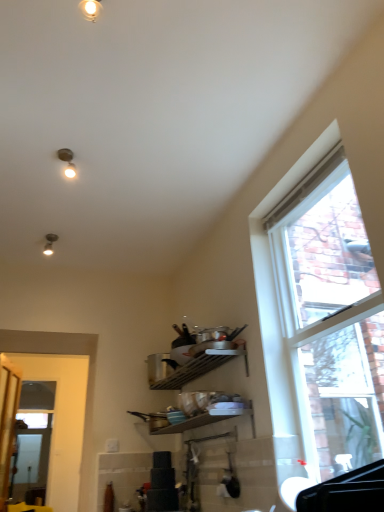
In order to face white glossy door at left, should I rotate leftwards or rightwards?

Rotate left and turn 19.771 degrees.

What is the approximate height of clear glass window at right?

clear glass window at right is 5.05 feet in height.

Describe the element at coordinates (49, 244) in the screenshot. The height and width of the screenshot is (512, 384). I see `matte silver light fixture at upper left, the 2th light fixture positioned from the right` at that location.

Identify the location of clear glass screen door at left. The image size is (384, 512). (30, 462).

Is clear glass window at right at the right side of clear glass screen door at left?

Correct, you'll find clear glass window at right to the right of clear glass screen door at left.

Considering the relative sizes of clear glass window at right and clear glass screen door at left in the image provided, is clear glass window at right taller than clear glass screen door at left?

Incorrect, the height of clear glass window at right is not larger of that of clear glass screen door at left.

Considering the relative sizes of clear glass window at right and clear glass screen door at left in the image provided, is clear glass window at right smaller than clear glass screen door at left?

No.

Is clear glass window at right oriented towards clear glass screen door at left?

No, clear glass window at right is not oriented towards clear glass screen door at left.

Looking at this image, is matte white light fixture at upper center, which appears as the first light fixture when viewed from the top, behind white glossy door at left?

No, the depth of matte white light fixture at upper center, which appears as the first light fixture when viewed from the top, is less than that of white glossy door at left.

From the image's perspective, is matte white light fixture at upper center, acting as the first light fixture starting from the front, located above white glossy door at left?

Indeed, from the image's perspective, matte white light fixture at upper center, acting as the first light fixture starting from the front, is shown above white glossy door at left.

From a real-world perspective, is matte white light fixture at upper center, acting as the first light fixture starting from the front, physically located above or below white glossy door at left?

In terms of real-world spatial position, matte white light fixture at upper center, acting as the first light fixture starting from the front, is above white glossy door at left.

Is clear glass screen door at left far from clear glass window at right?

Yes, clear glass screen door at left and clear glass window at right are located far from each other.

Consider the image. Considering the positions of objects clear glass screen door at left and clear glass window at right in the image provided, who is more to the left, clear glass screen door at left or clear glass window at right?

Positioned to the left is clear glass screen door at left.

Which is closer, (41, 470) or (274, 322)?

The point (274, 322) is more forward.

Does clear glass screen door at left have a lesser height compared to clear glass window at right?

Incorrect, the height of clear glass screen door at left does not fall short of that of clear glass window at right.

Is point (48, 234) less distant than point (23, 451)?

Yes.

Looking at this image, considering the sizes of matte silver light fixture at upper left, the first light fixture from the back, and clear glass screen door at left in the image, is matte silver light fixture at upper left, the first light fixture from the back, wider or thinner than clear glass screen door at left?

Clearly, matte silver light fixture at upper left, the first light fixture from the back, has more width compared to clear glass screen door at left.

From a real-world perspective, is matte silver light fixture at upper left, the 2th light fixture positioned from the right, beneath clear glass screen door at left?

Incorrect, from a real-world perspective, matte silver light fixture at upper left, the 2th light fixture positioned from the right, is higher than clear glass screen door at left.

Is matte silver light fixture at upper left, which is the second light fixture from front to back, to the left of clear glass screen door at left from the viewer's perspective?

No.

From a real-world perspective, is clear glass window at right physically above white glossy door at left?

Yes, from a real-world perspective, clear glass window at right is above white glossy door at left.

Is clear glass window at right not near white glossy door at left?

Absolutely, clear glass window at right is distant from white glossy door at left.

Does white glossy door at left have a larger size compared to matte silver light fixture at upper left, which is the 1th light fixture in bottom-to-top order?

Indeed, white glossy door at left has a larger size compared to matte silver light fixture at upper left, which is the 1th light fixture in bottom-to-top order.

You are a GUI agent. You are given a task and a screenshot of the screen. Output one action in this format:
    pyautogui.click(x=<x>, y=<y>)
    Task: Click on the door in front of the matte silver light fixture at upper left, the 2th light fixture positioned from the right
    
    Given the screenshot: What is the action you would take?
    pyautogui.click(x=61, y=420)

Considering the sizes of objects white glossy door at left and matte silver light fixture at upper left, which ranks as the 1th light fixture in left-to-right order, in the image provided, who is shorter, white glossy door at left or matte silver light fixture at upper left, which ranks as the 1th light fixture in left-to-right order,?

matte silver light fixture at upper left, which ranks as the 1th light fixture in left-to-right order, is shorter.

Considering the positions of objects white glossy door at left and matte silver light fixture at upper left, which is the second light fixture from front to back, in the image provided, who is behind, white glossy door at left or matte silver light fixture at upper left, which is the second light fixture from front to back,?

matte silver light fixture at upper left, which is the second light fixture from front to back, is further from the camera.

Considering the positions of points (7, 353) and (359, 322), is point (7, 353) closer to camera compared to point (359, 322)?

No.

Consider the image. Looking at their sizes, would you say white glossy door at left is wider or thinner than clear glass window at right?

Considering their sizes, white glossy door at left looks slimmer than clear glass window at right.

Can you tell me how much white glossy door at left and clear glass window at right differ in facing direction?

The angular difference between white glossy door at left and clear glass window at right is 89.8 degrees.

Would you say white glossy door at left is a long distance from clear glass window at right?

Yes.

You are a GUI agent. You are given a task and a screenshot of the screen. Output one action in this format:
    pyautogui.click(x=<x>, y=<y>)
    Task: Click on the screen door located on the left of clear glass window at right
    The width and height of the screenshot is (384, 512).
    Given the screenshot: What is the action you would take?
    pyautogui.click(x=30, y=462)

From the white glossy door at left, count 2nd light fixture to the right and point to it. Please provide its 2D coordinates.

[(90, 9)]

Estimate the real-world distances between objects in this image. Which object is further from clear glass window at right, matte silver light fixture at upper left, which is the 1th light fixture in bottom-to-top order, or clear glass screen door at left?

Based on the image, clear glass screen door at left appears to be further to clear glass window at right.

From the image, which object appears to be nearer to matte silver light fixture at upper left, which is the 1th light fixture in bottom-to-top order, white glossy door at left or clear glass window at right?

Based on the image, clear glass window at right appears to be nearer to matte silver light fixture at upper left, which is the 1th light fixture in bottom-to-top order.

Looking at the image, which one is located closer to matte white light fixture at upper center, the second light fixture viewed from the back, matte silver light fixture at upper left, which is counted as the 2th light fixture, starting from the top, or white glossy door at left?

The object closer to matte white light fixture at upper center, the second light fixture viewed from the back, is matte silver light fixture at upper left, which is counted as the 2th light fixture, starting from the top.

From the image, which object appears to be farther from clear glass window at right, matte white light fixture at upper center, which appears as the first light fixture when viewed from the top, or white glossy door at left?

white glossy door at left is further to clear glass window at right.

Looking at the image, which one is located closer to clear glass window at right, clear glass screen door at left or white glossy door at left?

Among the two, white glossy door at left is located nearer to clear glass window at right.

In the scene shown: Based on their spatial positions, is matte silver light fixture at upper left, the first light fixture from the back, or clear glass screen door at left closer to white glossy door at left?

clear glass screen door at left is positioned closer to the anchor white glossy door at left.

Considering their positions, is matte silver light fixture at upper left, which is the second light fixture from front to back, positioned further to clear glass screen door at left than white glossy door at left?

matte silver light fixture at upper left, which is the second light fixture from front to back, is further to clear glass screen door at left.

Which object lies nearer to the anchor point matte white light fixture at upper center, the second light fixture viewed from the back, clear glass screen door at left or matte silver light fixture at upper left, the 2th light fixture positioned from the right?

matte silver light fixture at upper left, the 2th light fixture positioned from the right, is closer to matte white light fixture at upper center, the second light fixture viewed from the back.

Identify the location of light fixture between matte white light fixture at upper center, the second light fixture viewed from the back, and white glossy door at left from top to bottom. This screenshot has width=384, height=512. (49, 244).

This screenshot has height=512, width=384. Find the location of `door between matte white light fixture at upper center, which is the 1th light fixture from right to left, and clear glass screen door at left, along the z-axis`. door between matte white light fixture at upper center, which is the 1th light fixture from right to left, and clear glass screen door at left, along the z-axis is located at coordinates (61, 420).

The image size is (384, 512). In order to click on light fixture between matte white light fixture at upper center, acting as the first light fixture starting from the front, and clear glass screen door at left, along the z-axis in this screenshot , I will do `click(49, 244)`.

The width and height of the screenshot is (384, 512). I want to click on window between matte white light fixture at upper center, which appears as the first light fixture when viewed from the top, and white glossy door at left vertically, so click(x=319, y=319).